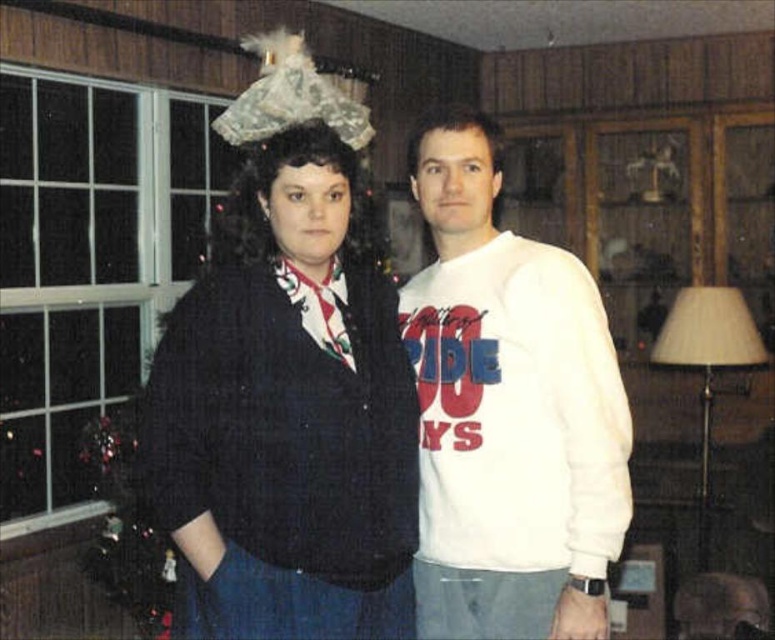
Question: Which of the following is the farthest from the observer?

Choices:
 (A) black knitted sweater at center
 (B) white cotton sweatshirt at center

Answer: (B)

Question: Among these objects, which one is nearest to the camera?

Choices:
 (A) black knitted sweater at center
 (B) white cotton sweatshirt at center

Answer: (A)

Question: Which object is farther from the camera taking this photo?

Choices:
 (A) white cotton sweatshirt at center
 (B) black knitted sweater at center

Answer: (A)

Question: Does black knitted sweater at center appear on the right side of white cotton sweatshirt at center?

Choices:
 (A) yes
 (B) no

Answer: (B)

Question: Considering the relative positions of black knitted sweater at center and white cotton sweatshirt at center in the image provided, where is black knitted sweater at center located with respect to white cotton sweatshirt at center?

Choices:
 (A) below
 (B) above

Answer: (A)

Question: Does black knitted sweater at center have a smaller size compared to white cotton sweatshirt at center?

Choices:
 (A) yes
 (B) no

Answer: (B)